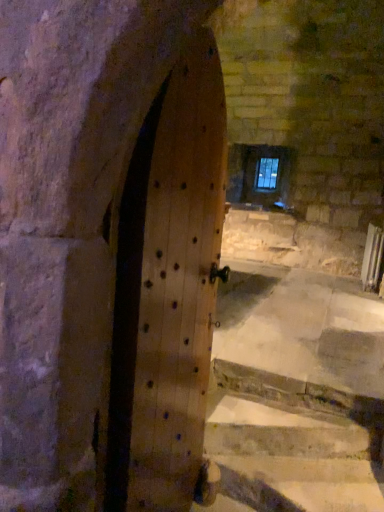
Question: Is clear glass window at upper center outside of natural wood door at center?

Choices:
 (A) no
 (B) yes

Answer: (B)

Question: Is clear glass window at upper center to the right of natural wood door at center from the viewer's perspective?

Choices:
 (A) no
 (B) yes

Answer: (B)

Question: Does clear glass window at upper center have a larger size compared to natural wood door at center?

Choices:
 (A) yes
 (B) no

Answer: (B)

Question: From the image's perspective, is clear glass window at upper center located beneath natural wood door at center?

Choices:
 (A) no
 (B) yes

Answer: (A)

Question: Are clear glass window at upper center and natural wood door at center located far from each other?

Choices:
 (A) no
 (B) yes

Answer: (B)

Question: Can you confirm if clear glass window at upper center is wider than natural wood door at center?

Choices:
 (A) yes
 (B) no

Answer: (B)

Question: Is clear glass window at upper center located within natural wood door at center?

Choices:
 (A) no
 (B) yes

Answer: (A)

Question: Considering the relative sizes of natural wood door at center and clear glass window at upper center in the image provided, is natural wood door at center smaller than clear glass window at upper center?

Choices:
 (A) no
 (B) yes

Answer: (A)

Question: Does natural wood door at center appear on the left side of clear glass window at upper center?

Choices:
 (A) yes
 (B) no

Answer: (A)

Question: Can you confirm if natural wood door at center is positioned to the right of clear glass window at upper center?

Choices:
 (A) no
 (B) yes

Answer: (A)

Question: From a real-world perspective, is natural wood door at center physically below clear glass window at upper center?

Choices:
 (A) no
 (B) yes

Answer: (B)

Question: Can you confirm if natural wood door at center is shorter than clear glass window at upper center?

Choices:
 (A) no
 (B) yes

Answer: (A)

Question: Would you say clear glass window at upper center is to the left or to the right of natural wood door at center in the picture?

Choices:
 (A) left
 (B) right

Answer: (B)